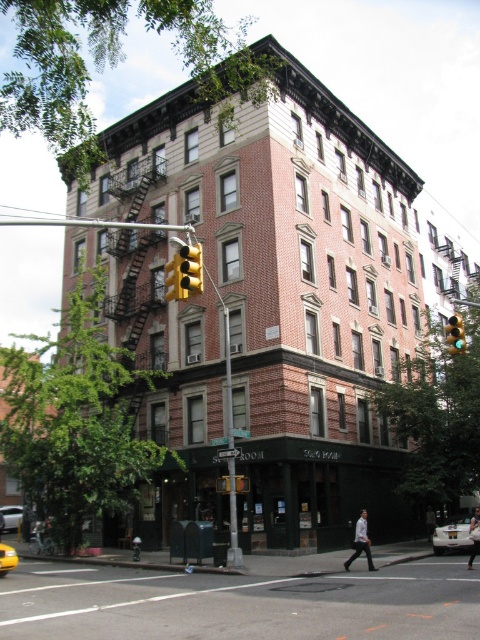
Question: Among these objects, which one is nearest to the camera?

Choices:
 (A) dark blue jeans at lower right
 (B) concrete sidewalk at lower center
 (C) yellow plastic traffic light at center
 (D) yellow plastic traffic light at upper center

Answer: (B)

Question: Does yellow plastic traffic light at upper center have a larger size compared to yellow plastic traffic light at center?

Choices:
 (A) no
 (B) yes

Answer: (A)

Question: Which of the following is the farthest from the observer?

Choices:
 (A) (472, 522)
 (B) (192, 292)
 (C) (359, 540)
 (D) (167, 285)

Answer: (D)

Question: Which point is farther to the camera?

Choices:
 (A) (187, 250)
 (B) (182, 296)
 (C) (367, 525)
 (D) (16, 563)

Answer: (C)

Question: Can you confirm if yellow rubber taxi at lower right is wider than yellow rubber taxi at lower left?

Choices:
 (A) no
 (B) yes

Answer: (B)

Question: Can you confirm if white cotton shirt at lower center is positioned to the left of yellow rubber taxi at lower left?

Choices:
 (A) no
 (B) yes

Answer: (A)